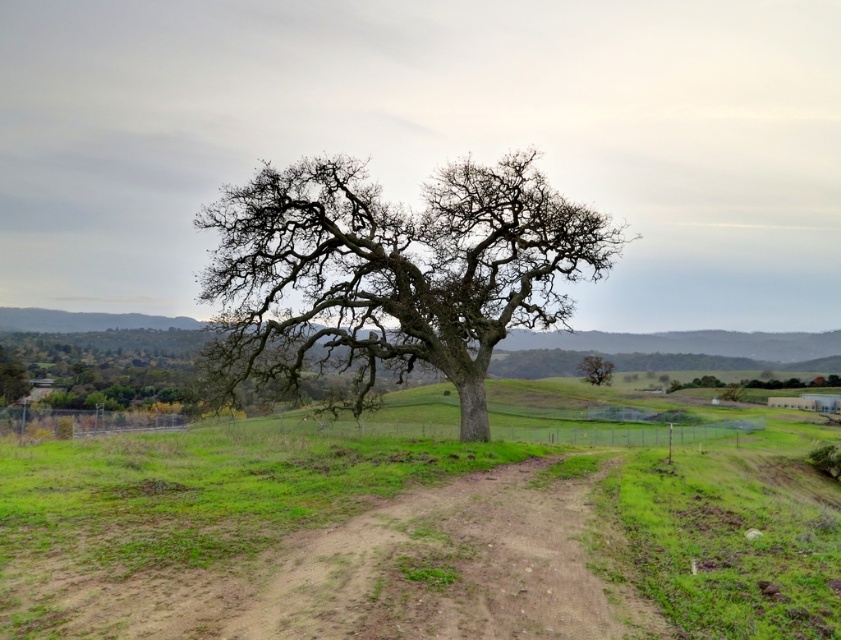
What do you see at coordinates (326, 564) in the screenshot? I see `brown dirt track at center` at bounding box center [326, 564].

Does brown dirt track at center have a lesser width compared to smooth bark oak at center?

Yes.

Which is in front, point (199, 595) or point (535, 204)?

Point (199, 595)

The image size is (841, 640). What are the coordinates of `brown dirt track at center` in the screenshot? It's located at (326, 564).

Who is positioned more to the right, brown dirt track at center or smooth brown tree at center?

smooth brown tree at center

Between point (577, 525) and point (586, 365), which one is positioned in front?

Positioned in front is point (577, 525).

Find the location of a particular element. The image size is (841, 640). brown dirt track at center is located at coordinates (326, 564).

Is smooth bark oak at center positioned at the back of smooth brown tree at center?

No, smooth bark oak at center is closer to the viewer.

Does smooth bark oak at center have a lesser width compared to smooth brown tree at center?

No, smooth bark oak at center is not thinner than smooth brown tree at center.

Measure the distance between point (398, 240) and camera.

85.24 feet

Locate an element on the screen. The width and height of the screenshot is (841, 640). smooth bark oak at center is located at coordinates (390, 273).